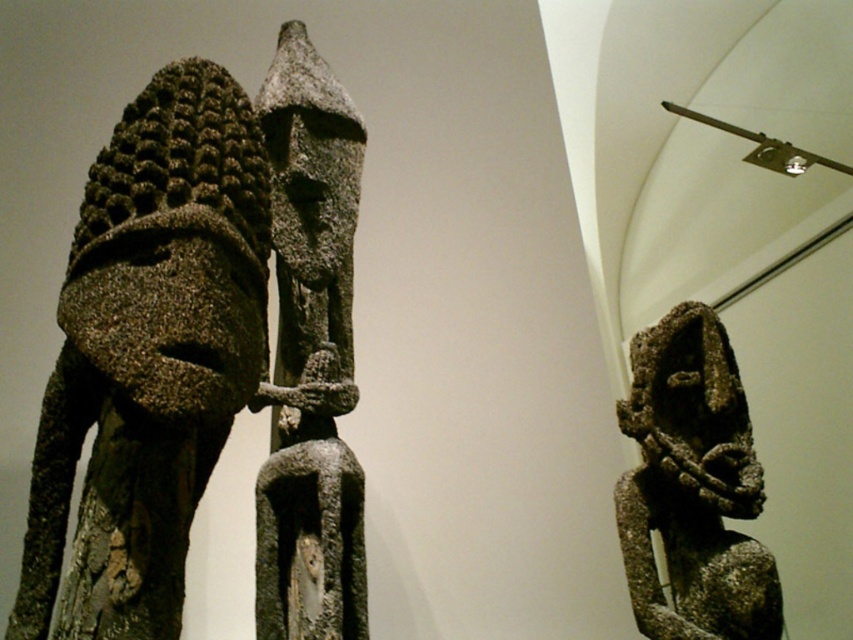
Between point (358, 579) and point (733, 516), which one is positioned behind?

The point (733, 516) is behind.

Describe the element at coordinates (311, 209) in the screenshot. I see `rough stone statue at center` at that location.

This screenshot has width=853, height=640. I want to click on rough stone statue at center, so click(x=311, y=209).

Can you confirm if rough stone mask at center is bigger than rough stone statue at center?

No, rough stone mask at center is not bigger than rough stone statue at center.

The image size is (853, 640). Identify the location of rough stone mask at center. (196, 340).

Who is taller, rough stone mask at center or rusty stone figure at center?

rough stone mask at center is taller.

Is rough stone mask at center below rusty stone figure at center?

Incorrect, rough stone mask at center is not positioned below rusty stone figure at center.

Locate an element on the screen. rough stone mask at center is located at coordinates (196, 340).

I want to click on rough stone mask at center, so click(x=196, y=340).